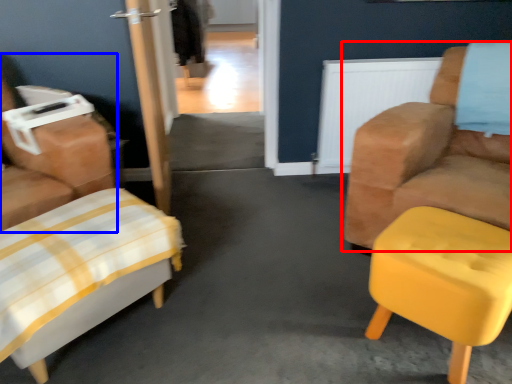
Question: Which of the following is the farthest to the observer, chair (highlighted by a red box) or chair (highlighted by a blue box)?

Choices:
 (A) chair
 (B) chair

Answer: (B)